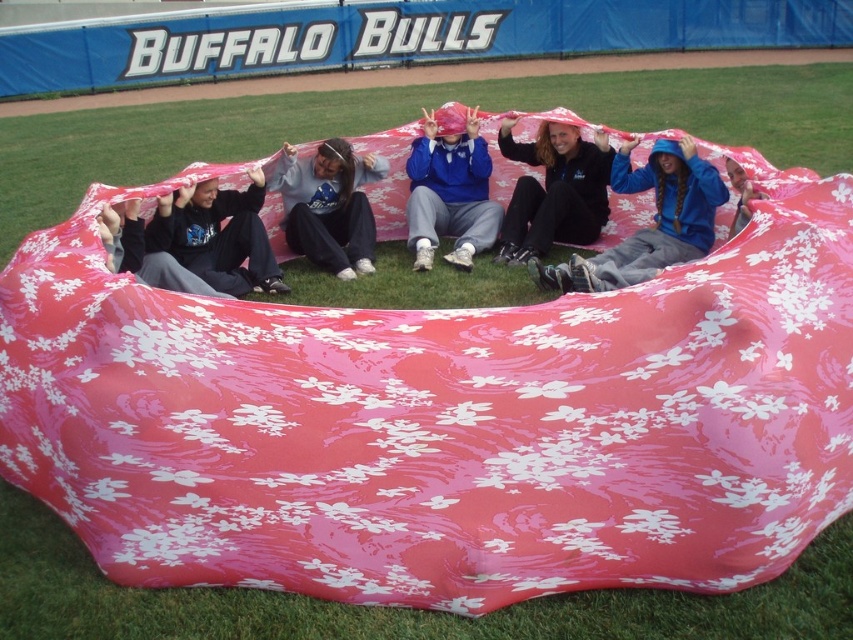
From the picture: You are a photographer standing at the edge of the field. You want to take a photo of the matte black hoodie at center without moving closer than 5 meters. Is the current distance sufficient?

The matte black hoodie at center is 6.21 meters away from the viewer, which is more than the 5 meters required, so the distance is sufficient to take the photo without moving closer.

You are standing at the origin point in the image. Which direction should you move to reach the matte black hoodie at center?

Answer: Since the matte black hoodie at center is located at point (554, 189), you should move northeast to reach it.